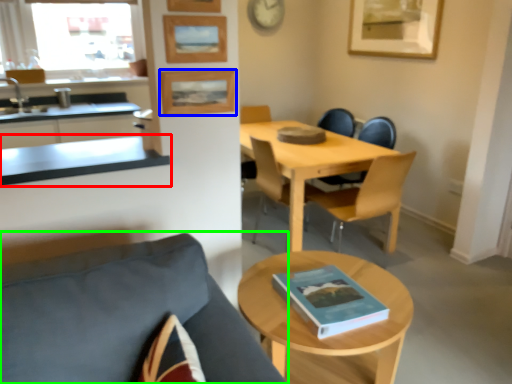
Question: Which object is the closest to the countertop (highlighted by a red box)? Choose among these: picture frame (highlighted by a blue box) or chair (highlighted by a green box).

Choices:
 (A) picture frame
 (B) chair

Answer: (A)